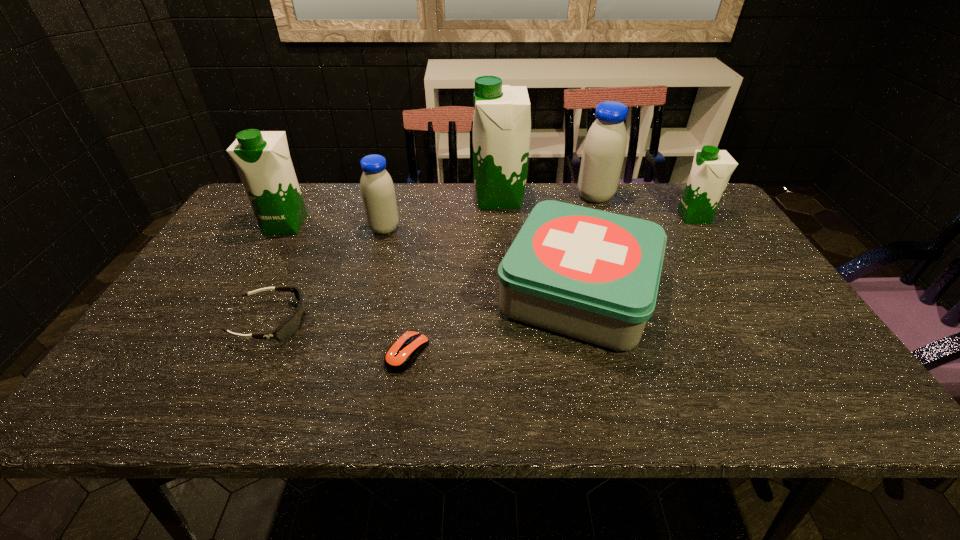
This screenshot has width=960, height=540. I want to click on the tallest soya milk, so click(x=502, y=116).

Find the location of a particular element. This screenshot has width=960, height=540. the third soya milk from left to right is located at coordinates (502, 116).

Find the location of a particular element. The image size is (960, 540). the farther blue soya milk is located at coordinates (604, 149).

At what (x,y) coordinates should I click in order to perform the action: click on the fourth soya milk from left to right. Please return your answer as a coordinate pair (x, y). Image resolution: width=960 pixels, height=540 pixels. Looking at the image, I should click on click(604, 149).

Find the location of a particular element. This screenshot has width=960, height=540. the leftmost soya milk is located at coordinates (262, 158).

Identify the location of the leftmost green soya milk. (262, 158).

You are a GUI agent. You are given a task and a screenshot of the screen. Output one action in this format:
    pyautogui.click(x=<x>, y=<y>)
    Task: Click on the rightmost soya milk
    
    Given the screenshot: What is the action you would take?
    pyautogui.click(x=711, y=169)

Where is `the rightmost green soya milk`? This screenshot has height=540, width=960. the rightmost green soya milk is located at coordinates (711, 169).

Where is `the sixth object from right to left`? the sixth object from right to left is located at coordinates (377, 190).

You are a GUI agent. You are given a task and a screenshot of the screen. Output one action in this format:
    pyautogui.click(x=<x>, y=<y>)
    Task: Click on the nearer blue soya milk
    This screenshot has height=540, width=960.
    Given the screenshot: What is the action you would take?
    pyautogui.click(x=377, y=190)